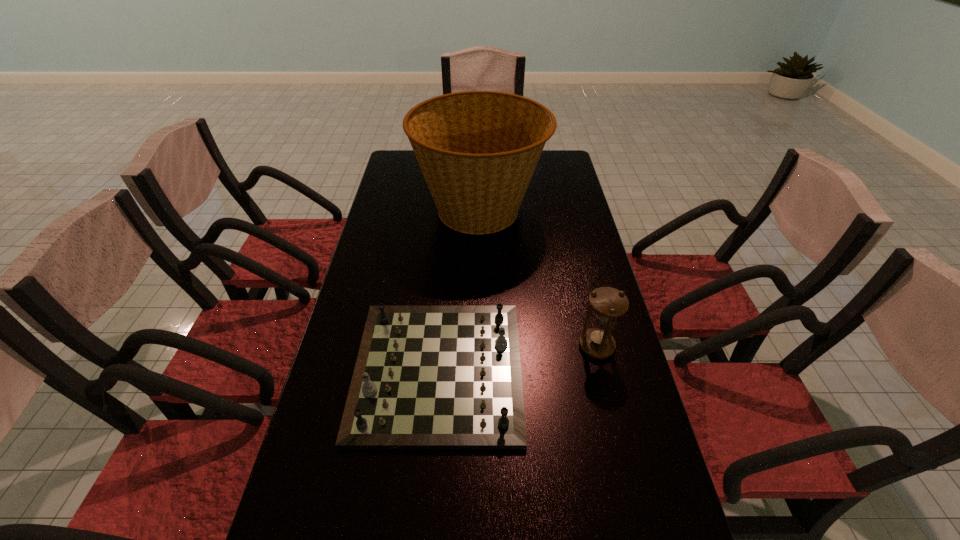
Locate an element on the screen. Image resolution: width=960 pixels, height=540 pixels. the farthest object is located at coordinates (477, 150).

Locate an element on the screen. basket is located at coordinates (477, 150).

Locate an element on the screen. the rightmost object is located at coordinates (608, 303).

Locate an element on the screen. The height and width of the screenshot is (540, 960). hourglass is located at coordinates (608, 303).

Identify the location of the shortest object. (426, 377).

Where is `vacant space located on the left of the farthest object`? This screenshot has height=540, width=960. vacant space located on the left of the farthest object is located at coordinates (400, 210).

The height and width of the screenshot is (540, 960). Identify the location of vacant space located on the back of the second tallest object. (589, 319).

Identify the location of free region located 0.180m on the board of the shortest object. Image resolution: width=960 pixels, height=540 pixels. (592, 370).

Image resolution: width=960 pixels, height=540 pixels. I want to click on object that is at the far edge, so click(x=477, y=150).

This screenshot has width=960, height=540. Identify the location of basket that is at the left edge. (477, 150).